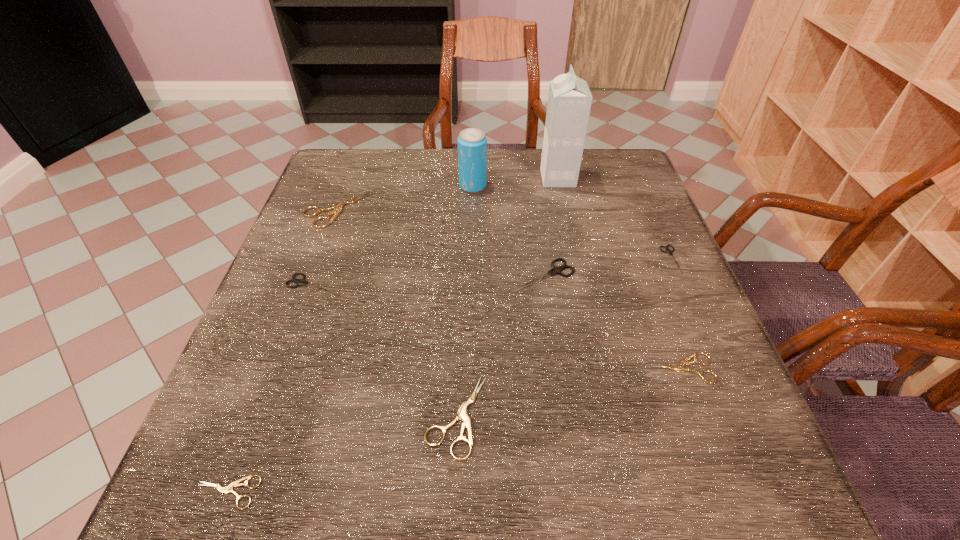
Where is `the closest black shears to the biggest black shears`? the closest black shears to the biggest black shears is located at coordinates (668, 251).

The image size is (960, 540). In order to click on beige shears object that ranks as the closest to the carton in this screenshot , I will do `click(338, 207)`.

This screenshot has width=960, height=540. I want to click on beige shears object that ranks as the third closest to the shortest shears, so click(x=681, y=367).

This screenshot has width=960, height=540. I want to click on free spot that satisfies the following two spatial constraints: 1. on the front side of the biggest beige shears; 2. on the left side of the smallest black shears, so click(x=319, y=259).

Find the location of a particular element. This screenshot has width=960, height=540. vacant region that satisfies the following two spatial constraints: 1. on the front label of the tallest object; 2. on the left side of the rightmost beige shears is located at coordinates (599, 368).

You are a GUI agent. You are given a task and a screenshot of the screen. Output one action in this format:
    pyautogui.click(x=<x>, y=<y>)
    Task: Click on the free space that satisfies the following two spatial constraints: 1. on the front label of the carton; 2. on the front side of the second biggest black shears
    
    Given the screenshot: What is the action you would take?
    pyautogui.click(x=581, y=284)

At what (x,y) coordinates should I click in order to perform the action: click on vacant region that satisfies the following two spatial constraints: 1. on the front side of the eighth shortest object; 2. on the left side of the third biggest beige shears. Please return your answer as a coordinate pair (x, y). This screenshot has height=540, width=960. Looking at the image, I should click on (469, 368).

Where is `vacant area in the image that satisfies the following two spatial constraints: 1. on the back side of the soda can; 2. on the right side of the shortest object`? vacant area in the image that satisfies the following two spatial constraints: 1. on the back side of the soda can; 2. on the right side of the shortest object is located at coordinates (342, 186).

Find the location of a particular element. Image resolution: width=960 pixels, height=540 pixels. free space that satisfies the following two spatial constraints: 1. on the back side of the nearest object; 2. on the left side of the farthest shears is located at coordinates (333, 210).

What are the coordinates of `vacant point that satisfies the following two spatial constraints: 1. on the front side of the soda can; 2. on the right side of the smallest black shears` in the screenshot? It's located at (471, 259).